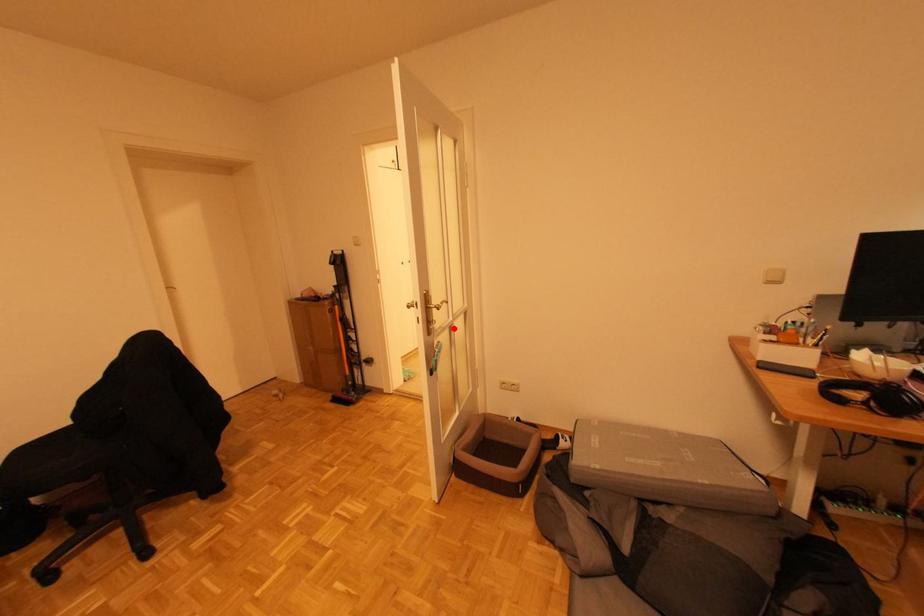
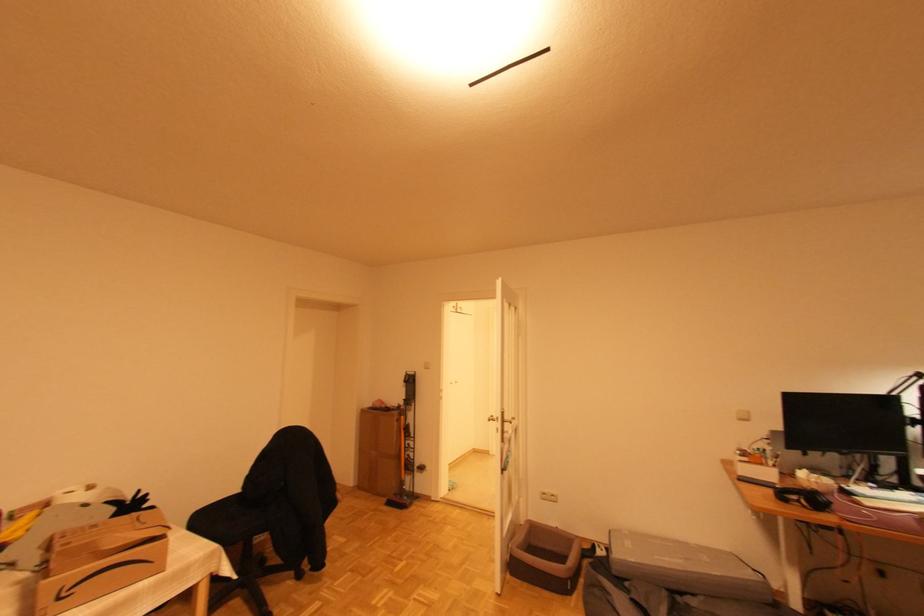
Question: I am providing you with two images of the same scene from different viewpoints. Given a red point in image1, look at the same physical point in image2. Is it:

Choices:
 (A) Closer to the viewpoint
 (B) Farther from the viewpoint

Answer: (B)